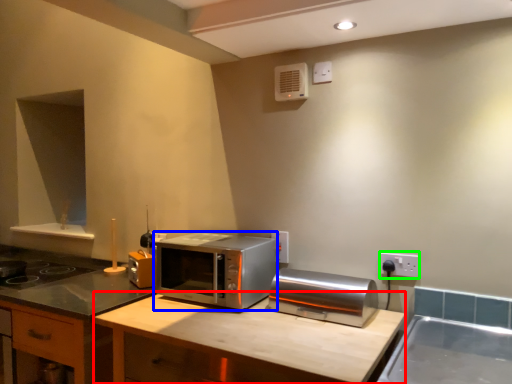
Question: Considering the real-world distances, which object is closest to counter top (highlighted by a red box)? microwave oven (highlighted by a blue box) or electric outlet (highlighted by a green box).

Choices:
 (A) microwave oven
 (B) electric outlet

Answer: (A)